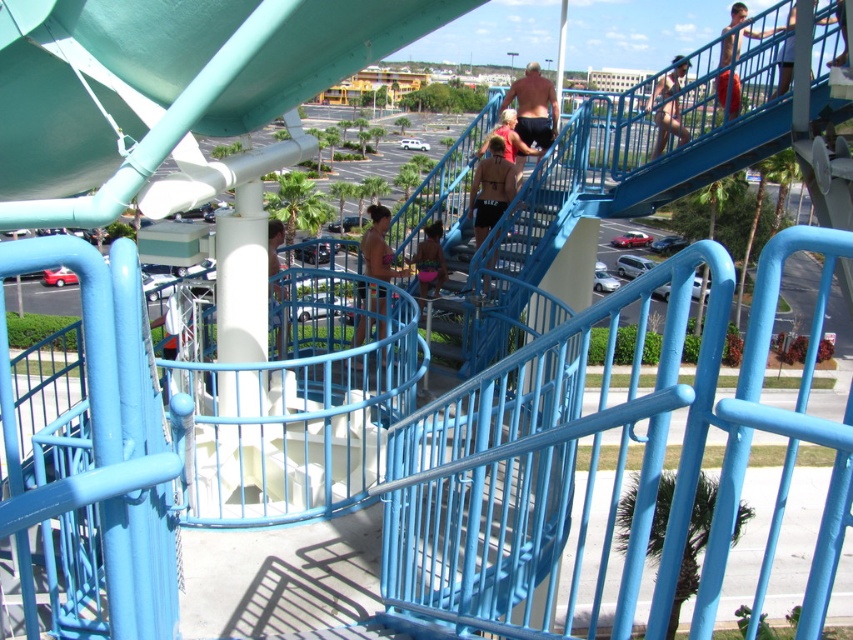
You are a photographer standing at the base of the blue metal staircase in the water park. You want to capture a photo of the smooth tan skin at upper right and the matte pink tank top at center. Which of the two subjects is positioned higher in the frame?

The smooth tan skin at upper right has a greater height compared to the matte pink tank top at center, so the smooth tan skin at upper right is positioned higher in the frame.

Consider the image. You are a lifeguard at the water park and need to ensure all visitors are properly dressed. You notice two visitors wearing a brown leather jacket at center and a matte pink tank top at center. Which clothing item is taller?

The brown leather jacket at center is much taller than the matte pink tank top at center.